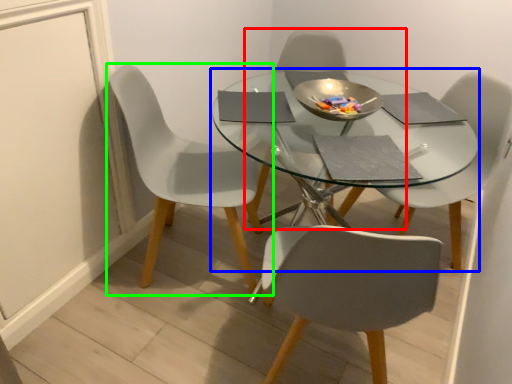
Question: Which object is positioned closest to chair (highlighted by a red box)? Select from round table (highlighted by a blue box) and chair (highlighted by a green box).

Choices:
 (A) round table
 (B) chair

Answer: (A)